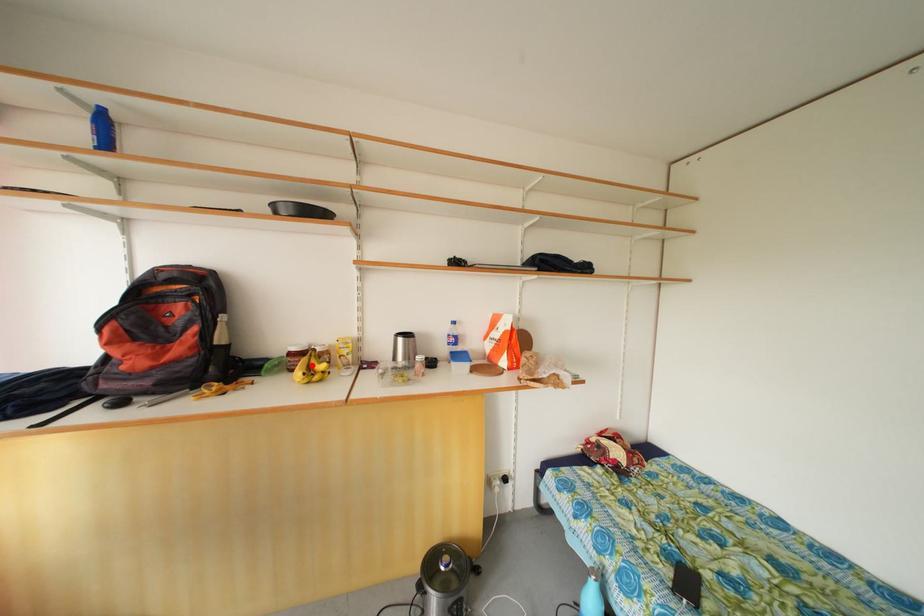
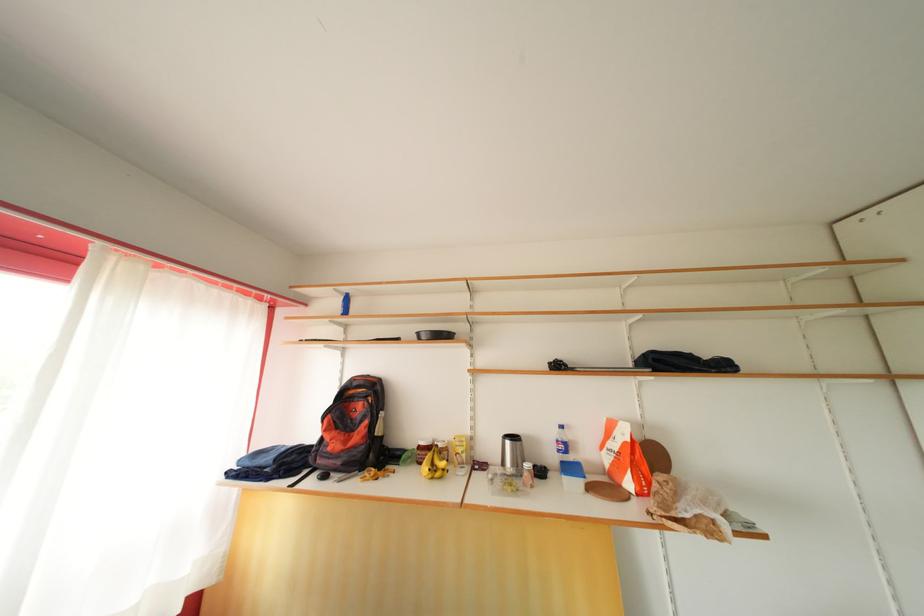
Locate, in the second image, the point that corresponds to the highlighted location in the first image.

(436, 461)